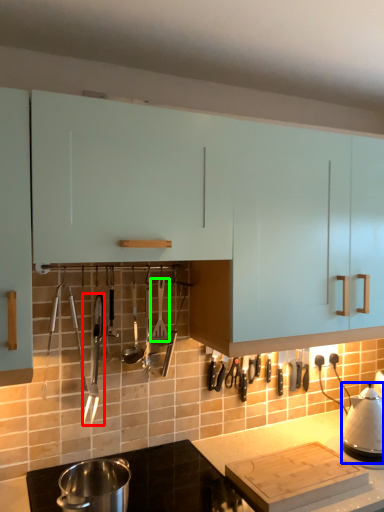
Question: Which is nearer to the silverware (highlighted by a red box)? kitchen appliance (highlighted by a blue box) or silverware (highlighted by a green box).

Choices:
 (A) kitchen appliance
 (B) silverware

Answer: (B)